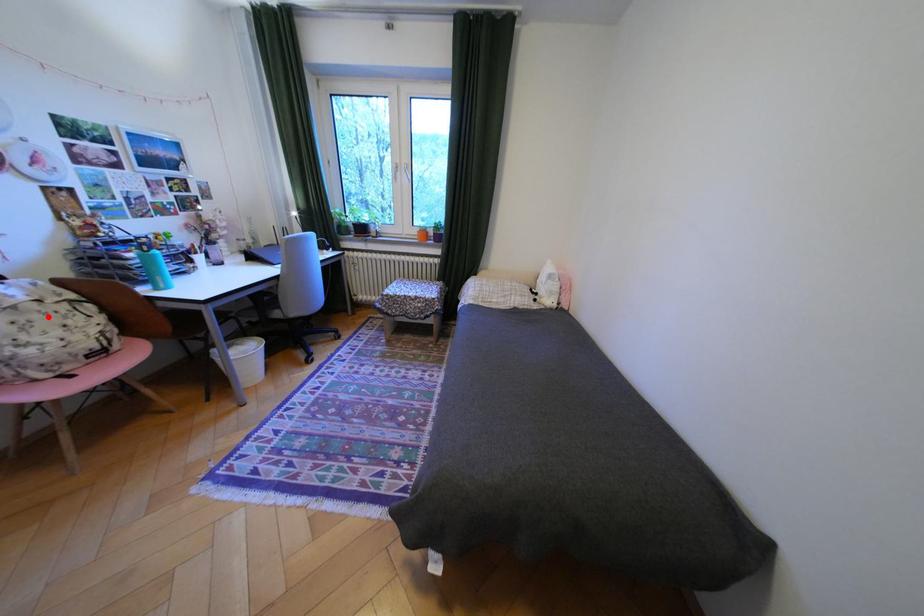
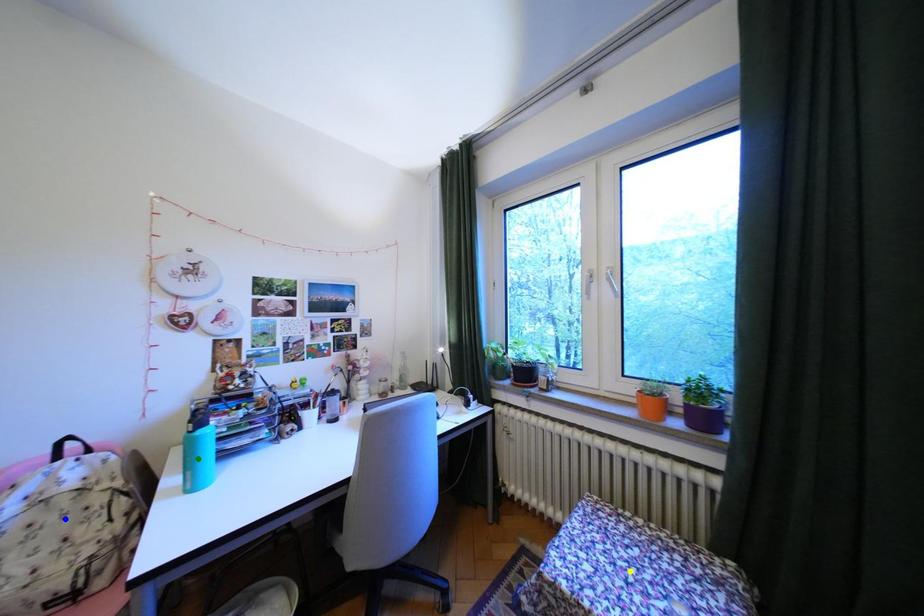
Question: I am providing you with two images of the same scene from different viewpoints. A red point is marked on the first image. You are given multiple points on the second image. Can you choose the point in image 2 that corresponds to the point in image 1?

Choices:
 (A) yellow point
 (B) blue point
 (C) green point

Answer: (B)